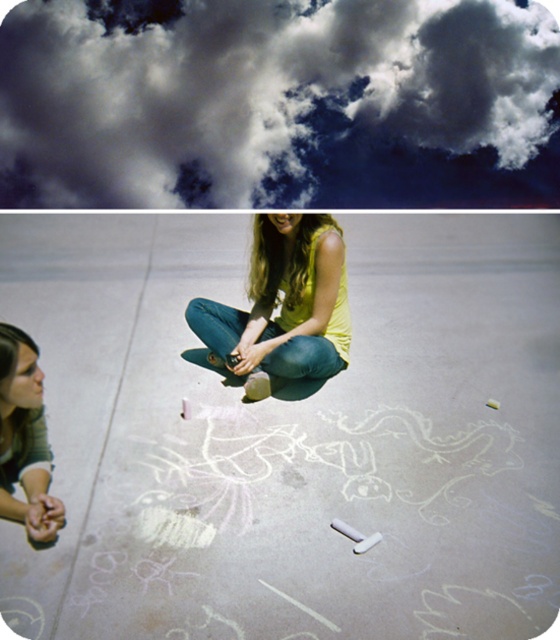
Question: Is smooth concrete pavement at center to the right of matte yellow shirt at center from the viewer's perspective?

Choices:
 (A) no
 (B) yes

Answer: (B)

Question: Is cloudy sky at upper center smaller than yellow matte tank top at center?

Choices:
 (A) no
 (B) yes

Answer: (A)

Question: Which point is closer to the camera?

Choices:
 (A) matte yellow shirt at center
 (B) yellow matte tank top at center

Answer: (A)

Question: Estimate the real-world distances between objects in this image. Which object is closer to the cloudy sky at upper center?

Choices:
 (A) smooth concrete pavement at center
 (B) matte yellow shirt at center

Answer: (A)

Question: Does cloudy sky at upper center have a larger size compared to yellow matte tank top at center?

Choices:
 (A) no
 (B) yes

Answer: (B)

Question: Based on their relative distances, which object is farther from the yellow matte tank top at center?

Choices:
 (A) smooth concrete pavement at center
 (B) matte yellow shirt at center
 (C) cloudy sky at upper center

Answer: (C)